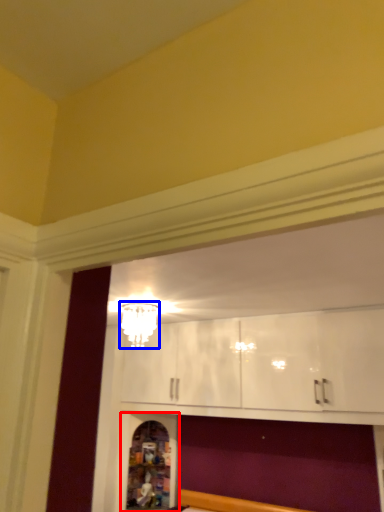
Question: Among these objects, which one is farthest to the camera, shelf (highlighted by a red box) or light fixture (highlighted by a blue box)?

Choices:
 (A) shelf
 (B) light fixture

Answer: (A)